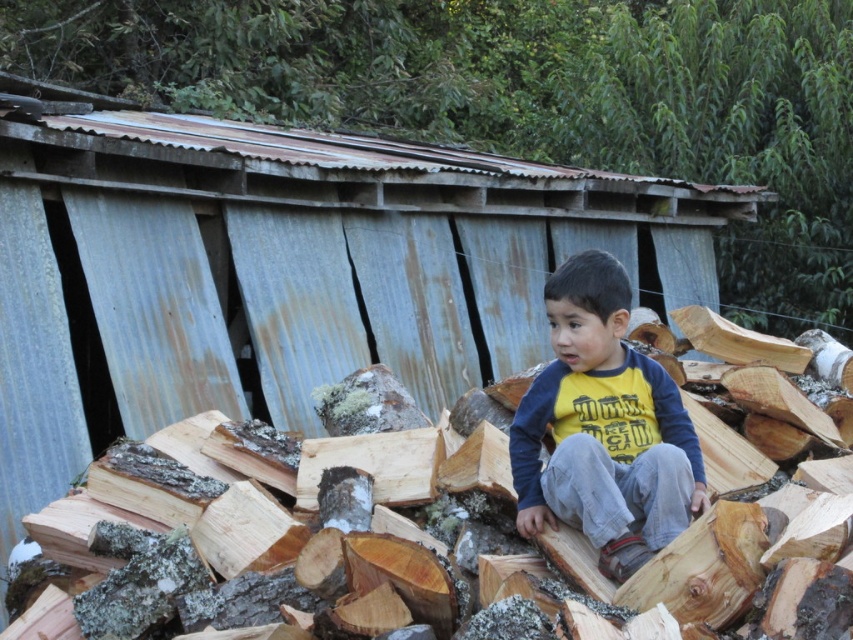
You are a photographer trying to capture the child in the yellow cotton shirt at center without including the brown rough wood at center in the frame. Given their positions, is this possible?

The brown rough wood at center is positioned on the left side of yellow cotton shirt at center. Since the wood is to the left of the shirt, if you position yourself to the left of the shirt, you can frame the shot to exclude the wood by angling the camera away from the left side.

You are a delivery person who needs to place a small package on the ground near the brown rough wood at center. Based on the scene, where exactly should you place the package in terms of coordinates?

The brown rough wood at center is located at coordinates point (573,506), so you should place the package near those coordinates.

You are a parent trying to ensure your child stays safe while playing with the brown rough wood at center and the yellow cotton shirt at center. Considering their sizes, which object is more likely to be a tripping hazard?

The yellow cotton shirt at center is taller than the brown rough wood at center, so the brown rough wood at center is shorter and closer to the ground, making it more likely to be a tripping hazard.